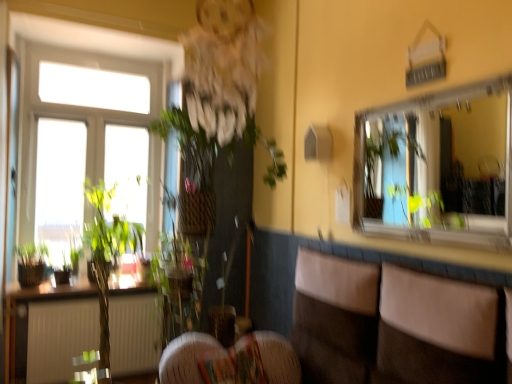
Question: From a real-world perspective, is brown leather couch at lower right physically located above or below clear glass mirror at upper right?

Choices:
 (A) below
 (B) above

Answer: (A)

Question: Do you think brown leather couch at lower right is within clear glass mirror at upper right, or outside of it?

Choices:
 (A) outside
 (B) inside

Answer: (A)

Question: Visually, is brown leather couch at lower right positioned to the left or to the right of clear glass mirror at upper right?

Choices:
 (A) left
 (B) right

Answer: (A)

Question: In the image, is clear glass mirror at upper right positioned in front of or behind brown leather couch at lower right?

Choices:
 (A) front
 (B) behind

Answer: (B)

Question: Choose the correct answer: Is clear glass mirror at upper right inside brown leather couch at lower right or outside it?

Choices:
 (A) outside
 (B) inside

Answer: (A)

Question: Visually, is clear glass mirror at upper right positioned to the left or to the right of brown leather couch at lower right?

Choices:
 (A) left
 (B) right

Answer: (B)

Question: From their relative heights in the image, would you say clear glass mirror at upper right is taller or shorter than brown leather couch at lower right?

Choices:
 (A) short
 (B) tall

Answer: (B)